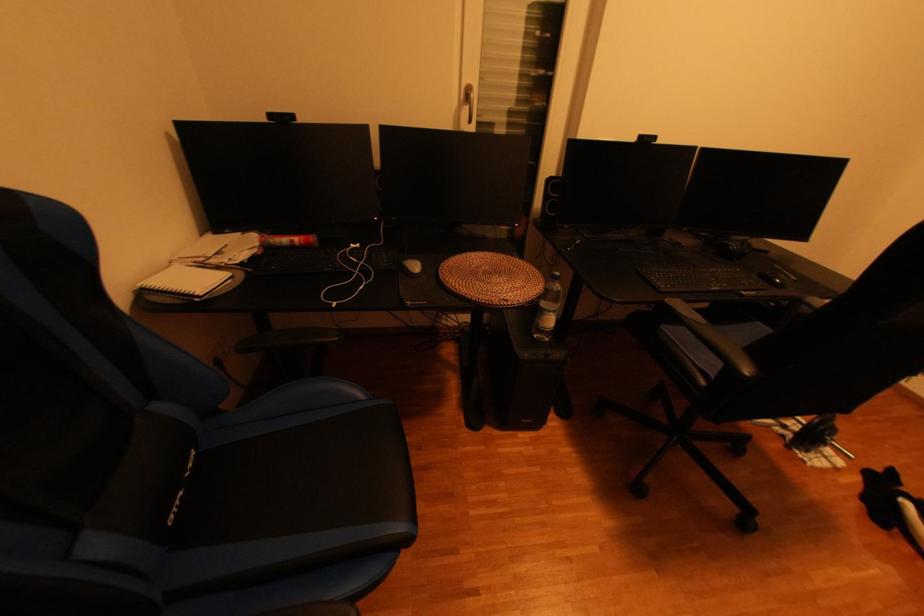
This screenshot has height=616, width=924. What do you see at coordinates (468, 102) in the screenshot?
I see `the white window handle` at bounding box center [468, 102].